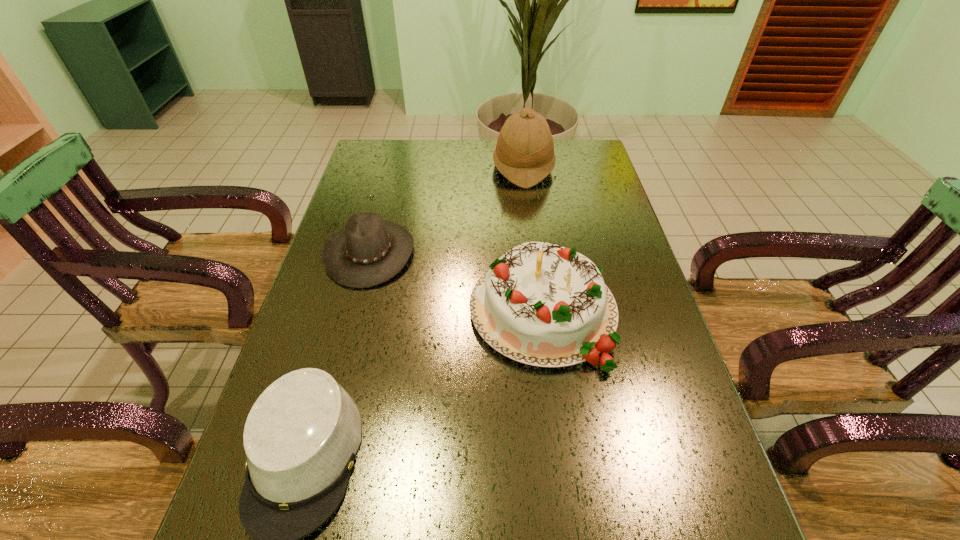
This screenshot has height=540, width=960. I want to click on the rightmost hat, so click(x=524, y=154).

Identify the location of the farthest object. Image resolution: width=960 pixels, height=540 pixels. (524, 154).

Where is `cake`? The width and height of the screenshot is (960, 540). cake is located at coordinates [x=541, y=304].

This screenshot has width=960, height=540. I want to click on the second farthest hat, so click(368, 251).

Locate an element on the screen. This screenshot has width=960, height=540. vacant space located 0.230m on the front-facing side of the farthest hat is located at coordinates (427, 167).

Where is `vacant space located on the front-facing side of the farthest hat`? vacant space located on the front-facing side of the farthest hat is located at coordinates (442, 167).

Where is `free spot located 0.360m on the front-facing side of the farthest hat`? The height and width of the screenshot is (540, 960). free spot located 0.360m on the front-facing side of the farthest hat is located at coordinates (390, 167).

The height and width of the screenshot is (540, 960). I want to click on vacant region located on the front of the cake, so click(x=555, y=406).

Locate an element on the screen. Image resolution: width=960 pixels, height=540 pixels. blank space located 0.290m on the front-facing side of the second farthest hat is located at coordinates (517, 252).

Where is `object that is at the far edge`? This screenshot has height=540, width=960. object that is at the far edge is located at coordinates (524, 154).